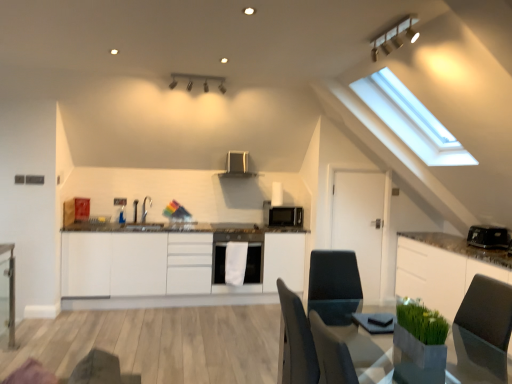
At what (x,y) coordinates should I click in order to perform the action: click on vacant space situated above white matte door at center (from a real-world perspective). Please return your answer as a coordinate pair (x, y). The width and height of the screenshot is (512, 384). Looking at the image, I should click on click(358, 160).